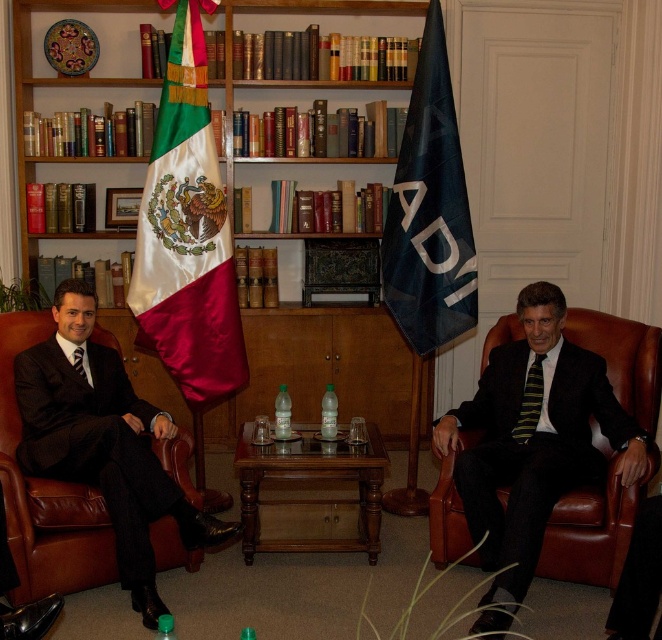
Does point (120, 566) lie in front of point (432, 172)?

Yes, point (120, 566) is closer to viewer.

Who is shorter, dark brown leather suit at left or blue fabric flag at center?

dark brown leather suit at left is shorter.

Does point (68, 445) come in front of point (404, 138)?

That is True.

Locate an element on the screen. Image resolution: width=662 pixels, height=640 pixels. dark brown leather suit at left is located at coordinates (105, 444).

Between blue fabric flag at center and yellow-green striped tie at right, which one is positioned lower?

Result: Positioned lower is yellow-green striped tie at right.

The width and height of the screenshot is (662, 640). What are the coordinates of `blue fabric flag at center` in the screenshot? It's located at (430, 211).

Does wooden bookshelf at upper center have a greater width compared to blue fabric flag at center?

Yes, wooden bookshelf at upper center is wider than blue fabric flag at center.

Is wooden bookshelf at upper center further to the viewer compared to blue fabric flag at center?

Yes, wooden bookshelf at upper center is further from the viewer.

What do you see at coordinates (379, 376) in the screenshot?
I see `wooden bookshelf at upper center` at bounding box center [379, 376].

You are a GUI agent. You are given a task and a screenshot of the screen. Output one action in this format:
    pyautogui.click(x=<x>, y=<y>)
    Task: Click on the wooden bookshelf at upper center
    This screenshot has height=640, width=662.
    Given the screenshot: What is the action you would take?
    pyautogui.click(x=379, y=376)